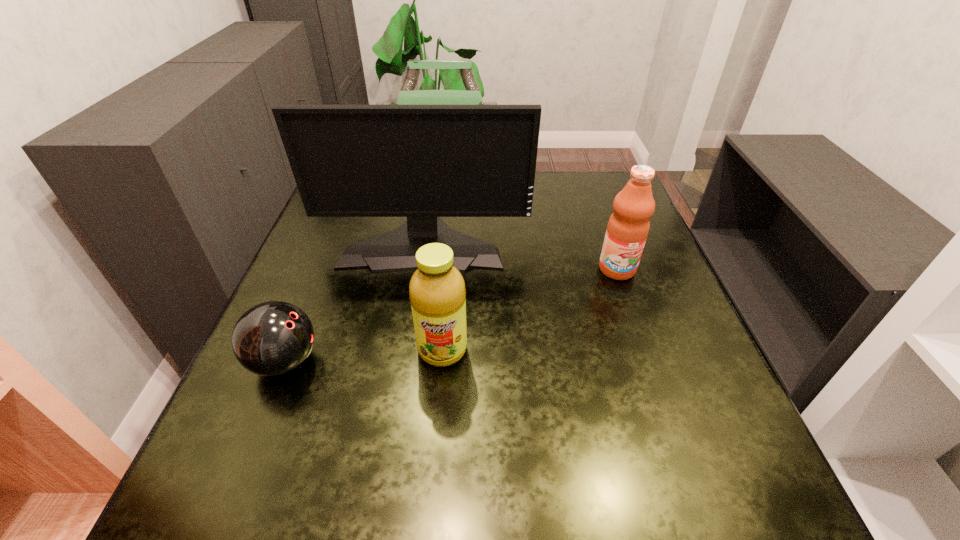
This screenshot has width=960, height=540. I want to click on bowling ball that is at the left edge, so click(273, 338).

This screenshot has height=540, width=960. What are the coordinates of `object present at the right edge` in the screenshot? It's located at (628, 226).

Find the location of a particular element. vacant space at the far edge of the desktop is located at coordinates (540, 190).

What are the coordinates of `free space at the left edge of the desktop` in the screenshot? It's located at (312, 393).

I want to click on free space at the right edge of the desktop, so click(621, 305).

This screenshot has width=960, height=540. I want to click on vacant area at the near left corner of the desktop, so click(264, 522).

The image size is (960, 540). What are the coordinates of `free space between the monitor and the right fruit juice` in the screenshot? It's located at (520, 256).

This screenshot has height=540, width=960. I want to click on free spot between the tallest object and the rightmost object, so click(520, 256).

The height and width of the screenshot is (540, 960). I want to click on free spot between the right fruit juice and the tallest object, so click(520, 256).

Find the location of a particular element. The height and width of the screenshot is (540, 960). blank region between the shortest object and the left fruit juice is located at coordinates (364, 356).